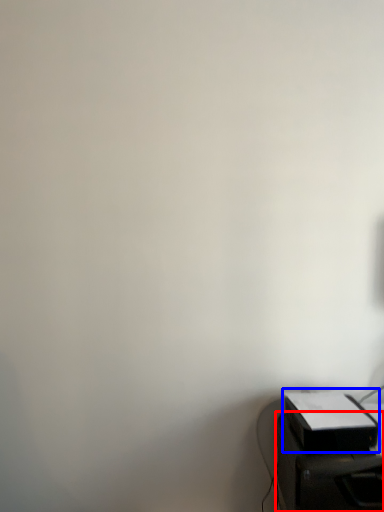
Question: Which point is further to the camera, furniture (highlighted by a red box) or printer (highlighted by a blue box)?

Choices:
 (A) furniture
 (B) printer

Answer: (B)